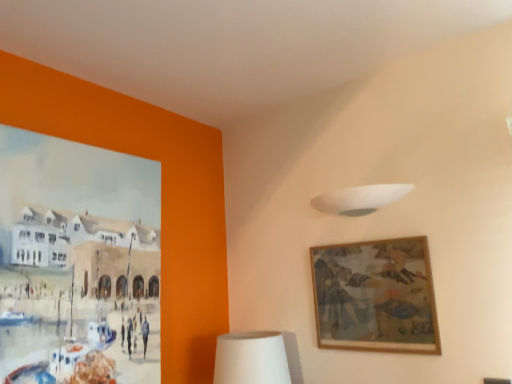
Question: Is white matte table lamp at lower center shorter than wooden framed artwork at upper right?

Choices:
 (A) yes
 (B) no

Answer: (A)

Question: From a real-world perspective, does white matte table lamp at lower center stand above wooden framed artwork at upper right?

Choices:
 (A) no
 (B) yes

Answer: (A)

Question: Is white matte table lamp at lower center to the right of wooden framed artwork at upper right from the viewer's perspective?

Choices:
 (A) no
 (B) yes

Answer: (A)

Question: Is white matte table lamp at lower center far from wooden framed artwork at upper right?

Choices:
 (A) no
 (B) yes

Answer: (A)

Question: Does white matte table lamp at lower center have a smaller size compared to wooden framed artwork at upper right?

Choices:
 (A) yes
 (B) no

Answer: (B)

Question: Is white matte table lamp at lower center thinner than wooden framed artwork at upper right?

Choices:
 (A) no
 (B) yes

Answer: (A)

Question: Is wooden framed artwork at upper right oriented away from white matte table lamp at lower center?

Choices:
 (A) no
 (B) yes

Answer: (A)

Question: Can you confirm if wooden framed artwork at upper right is thinner than white matte table lamp at lower center?

Choices:
 (A) no
 (B) yes

Answer: (B)

Question: Would you say wooden framed artwork at upper right is a long distance from white matte table lamp at lower center?

Choices:
 (A) no
 (B) yes

Answer: (A)

Question: Considering the relative sizes of wooden framed artwork at upper right and white matte table lamp at lower center in the image provided, is wooden framed artwork at upper right taller than white matte table lamp at lower center?

Choices:
 (A) yes
 (B) no

Answer: (A)

Question: Is wooden framed artwork at upper right at the right side of white matte table lamp at lower center?

Choices:
 (A) yes
 (B) no

Answer: (A)

Question: From the image's perspective, is wooden framed artwork at upper right below white matte table lamp at lower center?

Choices:
 (A) yes
 (B) no

Answer: (B)

Question: Considering the relative sizes of white matte lampshade at upper center and white matte table lamp at lower center in the image provided, is white matte lampshade at upper center taller than white matte table lamp at lower center?

Choices:
 (A) no
 (B) yes

Answer: (A)